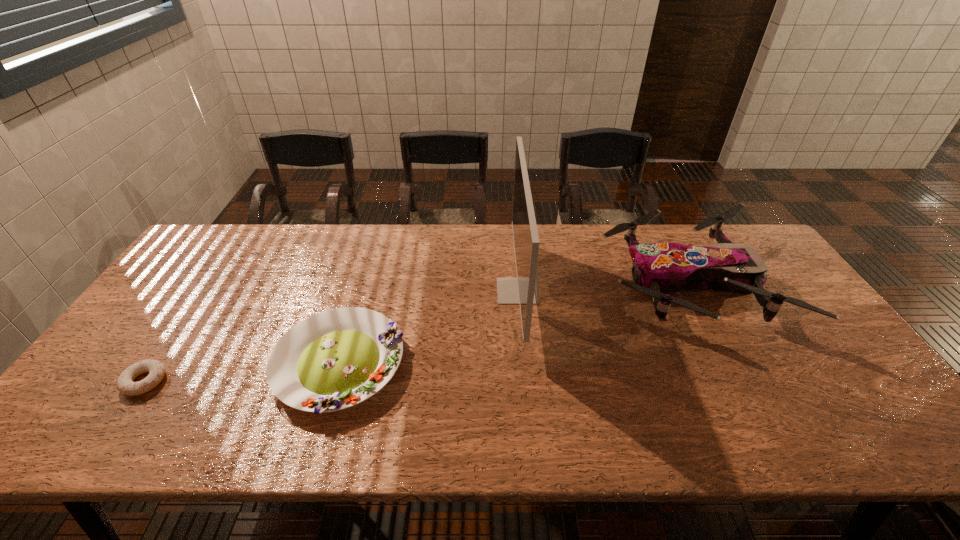
The height and width of the screenshot is (540, 960). What are the coordinates of `free space in the image that satisfies the following two spatial constraints: 1. on the front-facing side of the rightmost object; 2. on the front side of the doughnut` in the screenshot? It's located at (738, 381).

Identify the location of vacant position in the image that satisfies the following two spatial constraints: 1. on the front-facing side of the tallest object; 2. on the front side of the third tallest object. The height and width of the screenshot is (540, 960). (524, 364).